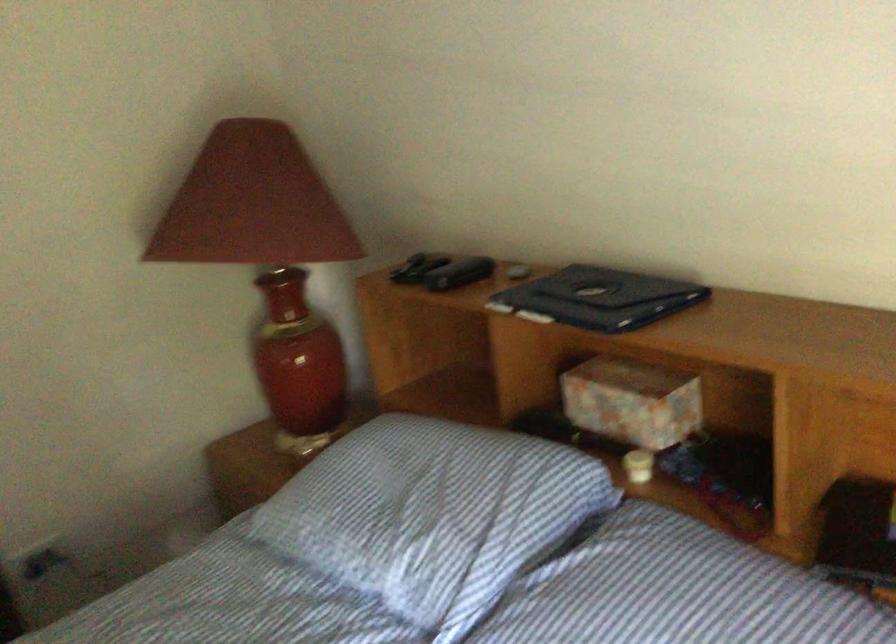
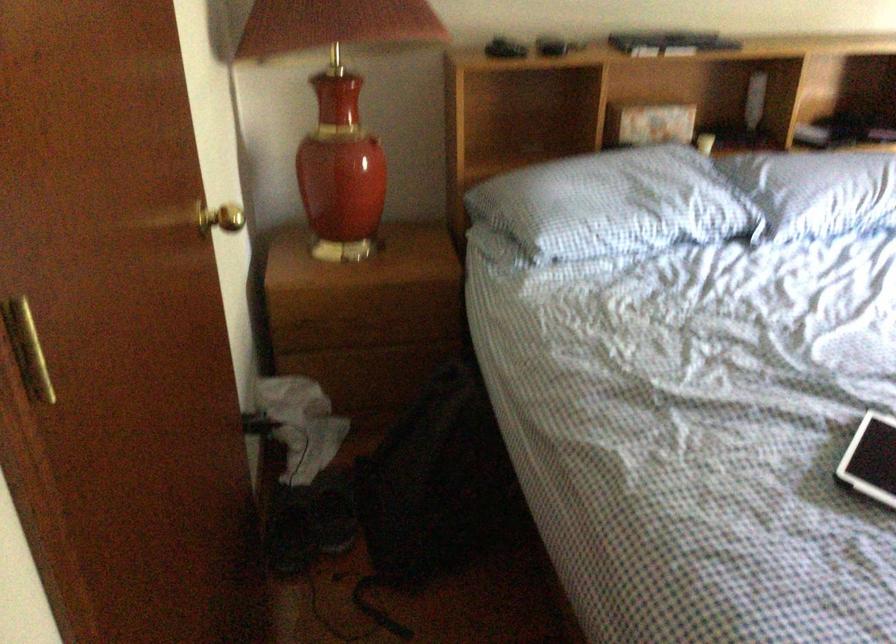
The point at (362, 493) is marked in the first image. Where is the corresponding point in the second image?

(613, 204)